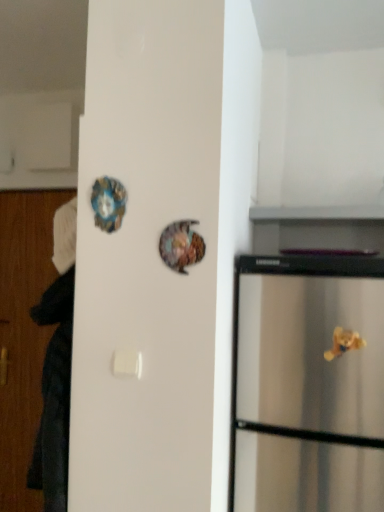
The width and height of the screenshot is (384, 512). Describe the element at coordinates (24, 247) in the screenshot. I see `wooden door at left` at that location.

Where is `wooden door at left`? wooden door at left is located at coordinates (24, 247).

This screenshot has height=512, width=384. What are the coordinates of `wooden door at left` in the screenshot? It's located at (24, 247).